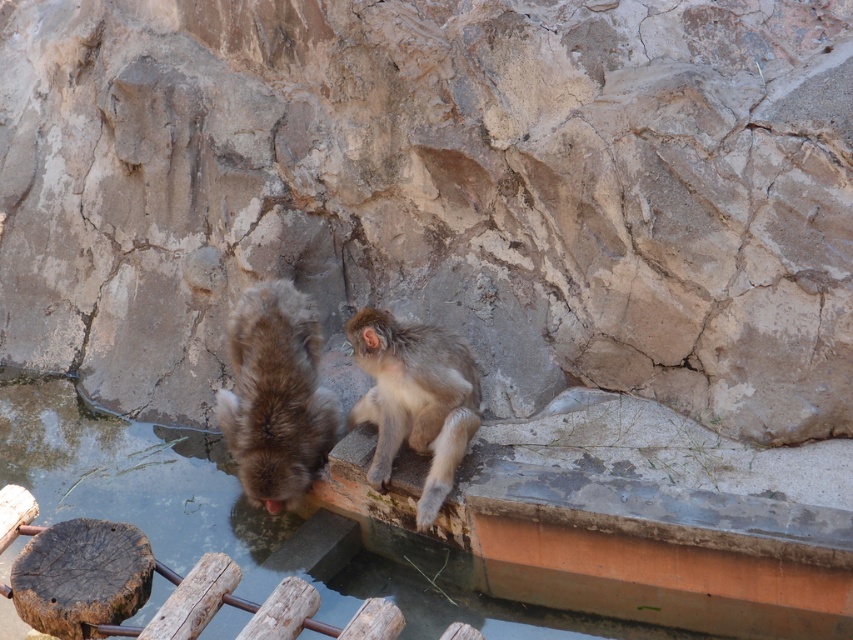
You are a zookeeper standing in front of the enclosure. You notice the clear water at monkey right and the fuzzy gray monkey at center. Which object is nearer to you?

The clear water at monkey right is closer to the viewer than the fuzzy gray monkey at center.

You are a zookeeper who needs to ensure the monkeys have enough space to move around. The enclosure has a rule that the water area must be wider than the largest monkey to prevent overcrowding. Given the clear water at monkey right and the fuzzy brown monkey at center, which one is wider?

The clear water at monkey right is wider than the fuzzy brown monkey at center, so it meets the enclosure requirements.

You are a zookeeper who needs to separate the two monkeys for feeding. Given that the distance between the fuzzy brown monkey at center and the fuzzy gray monkey at center is 16.22 inches, can you safely use a 18 inch long divider to separate them without them reaching each other?

The distance between the fuzzy brown monkey at center and the fuzzy gray monkey at center is 16.22 inches. A 18 inch long divider would provide enough space, so yes, the divider can safely separate them as the divider length exceeds the distance between them.